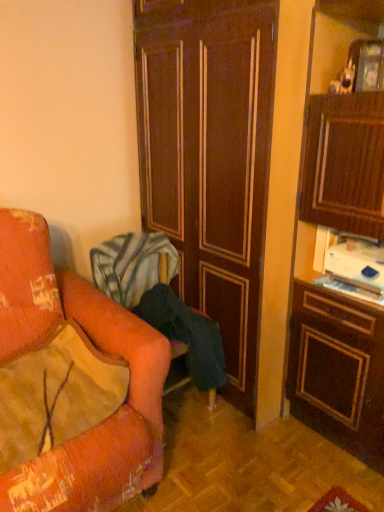
Question: Looking at the image, does dark wood door at center seem bigger or smaller compared to velvet orange pillow at left?

Choices:
 (A) big
 (B) small

Answer: (A)

Question: Considering the positions of dark wood door at center and velvet orange pillow at left in the image, is dark wood door at center wider or thinner than velvet orange pillow at left?

Choices:
 (A) thin
 (B) wide

Answer: (B)

Question: Considering the real-world distances, which object is closest to the dark wood door at center?

Choices:
 (A) velvet orange pillow at left
 (B) velvet orange chair at left

Answer: (B)

Question: Estimate the real-world distances between objects in this image. Which object is closer to the velvet orange chair at left?

Choices:
 (A) dark wood door at center
 (B) velvet orange pillow at left

Answer: (A)